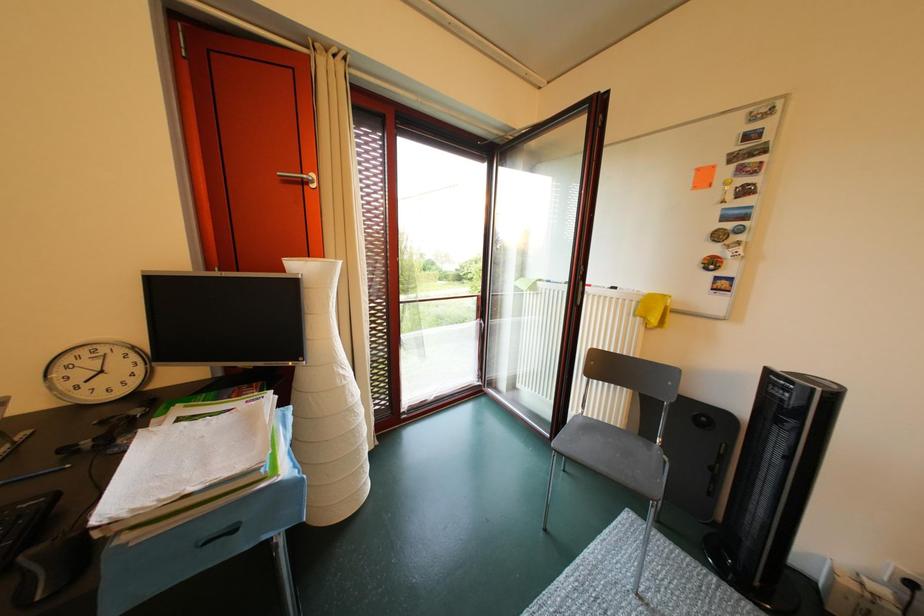
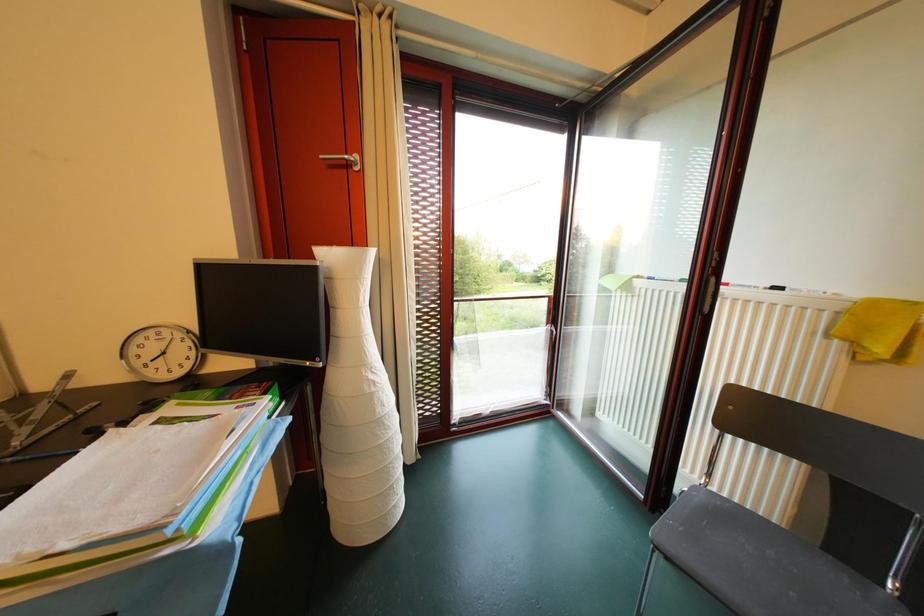
Question: The first image is from the beginning of the video and the second image is from the end. How did the camera likely rotate when shooting the video?

Choices:
 (A) Left
 (B) Right
 (C) Up
 (D) Down

Answer: (A)